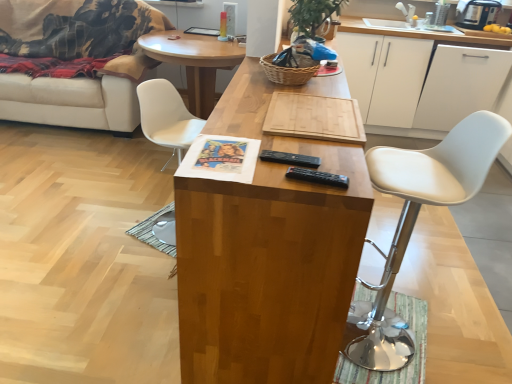
Where is `vacant area to the right of wooden cutting board at center, positioned as the second coffee table in back-to-front order`? The width and height of the screenshot is (512, 384). vacant area to the right of wooden cutting board at center, positioned as the second coffee table in back-to-front order is located at coordinates (449, 275).